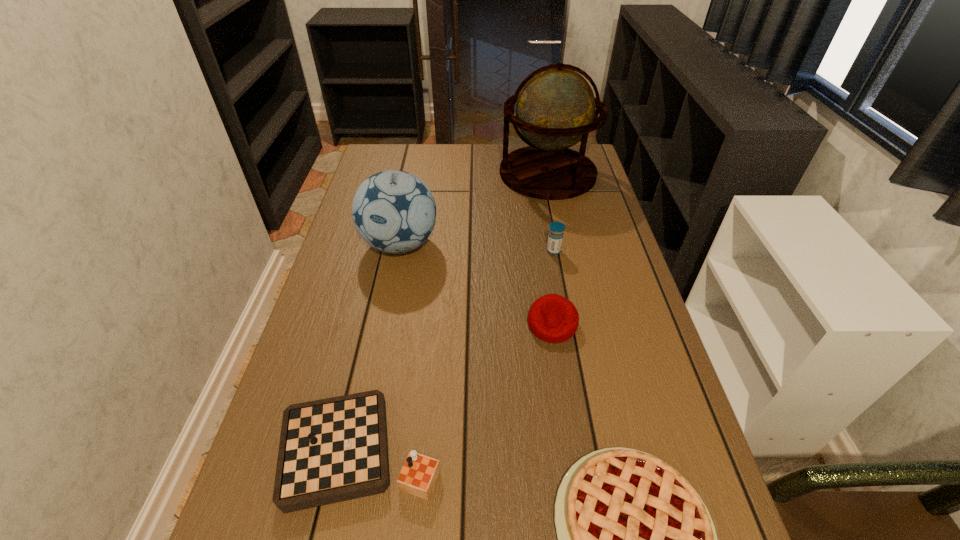
Locate an element on the screen. Image resolution: width=960 pixels, height=540 pixels. vacant space at the right edge is located at coordinates (595, 221).

In the image, there is a desktop. In order to click on vacant space at the far right corner in this screenshot , I will do `click(578, 148)`.

Locate an element on the screen. The height and width of the screenshot is (540, 960). free space that is in between the chessboard and the beanbag is located at coordinates (456, 387).

I want to click on free space between the second tallest object and the chessboard, so click(x=380, y=347).

Find the location of a particular element. vacant area that lies between the chessboard and the tallest object is located at coordinates (454, 312).

Where is `free space between the farthest object and the fifth shortest object`? free space between the farthest object and the fifth shortest object is located at coordinates (474, 209).

Image resolution: width=960 pixels, height=540 pixels. I want to click on vacant space in between the globe and the third tallest object, so click(x=551, y=212).

Where is `blank region between the farthest object and the chessboard`? This screenshot has height=540, width=960. blank region between the farthest object and the chessboard is located at coordinates (454, 312).

Image resolution: width=960 pixels, height=540 pixels. Identify the location of free space between the soccer ball and the fourth farthest object. (476, 284).

This screenshot has width=960, height=540. In order to click on vacant area between the chessboard and the third nearest object in this screenshot , I will do `click(456, 387)`.